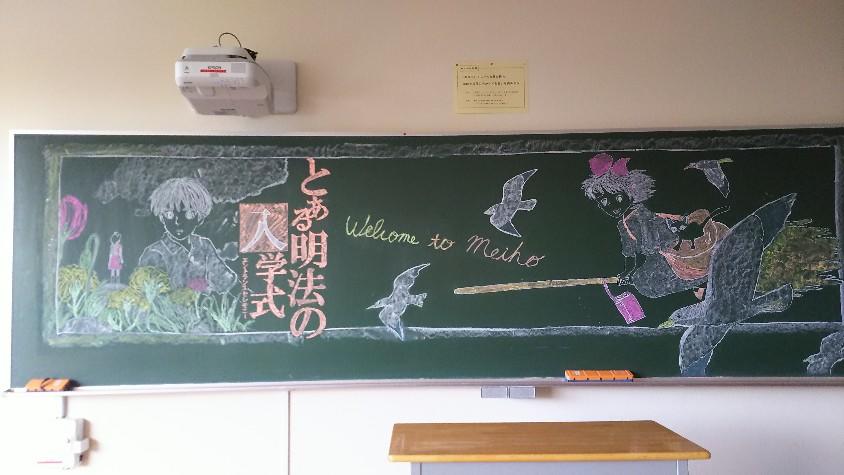
Find the location of `teacher desk`. teacher desk is located at coordinates (511, 451).